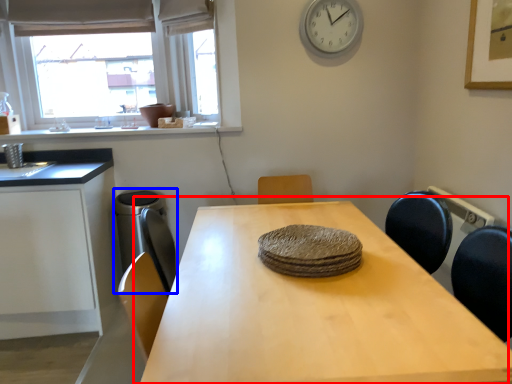
Question: Which of the following is the closest to the observer, table (highlighted by a red box) or appliance (highlighted by a blue box)?

Choices:
 (A) table
 (B) appliance

Answer: (A)